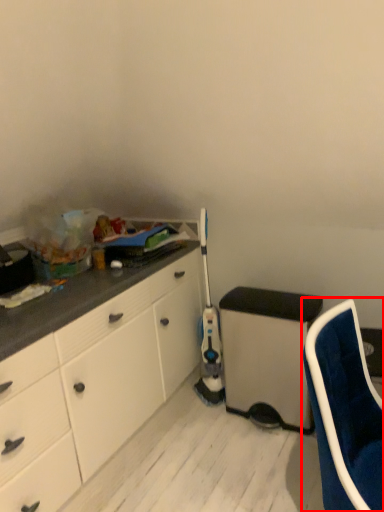
Question: In this image, where is chair (annotated by the red box) located relative to appliance?

Choices:
 (A) left
 (B) right

Answer: (B)